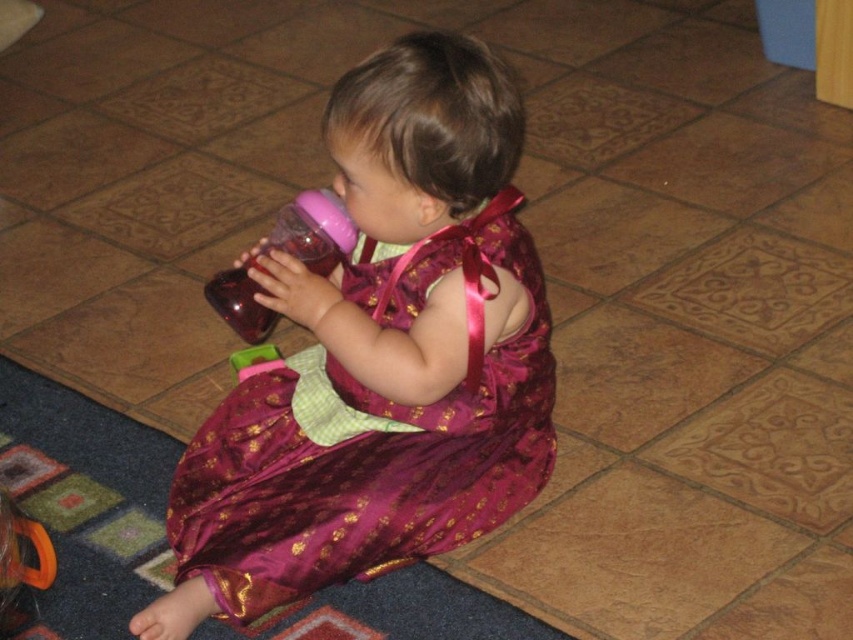
You are a parent trying to locate your child in a room. You see the shiny purple dress at center and the pink plastic bottle at center. Which object is closer to the floor?

The shiny purple dress at center is located below the pink plastic bottle at center, so the shiny purple dress at center is closer to the floor.